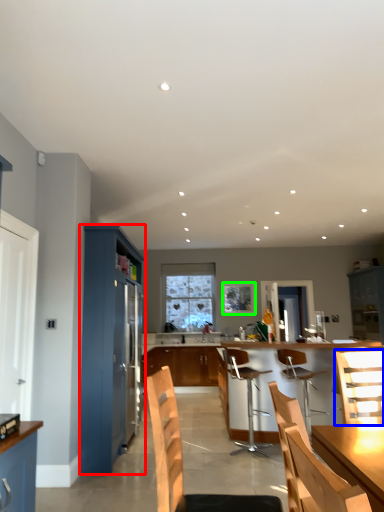
Question: Based on their relative distances, which object is farther from cabinetry (highlighted by a red box)? Choose from chair (highlighted by a blue box) and window screen (highlighted by a green box).

Choices:
 (A) chair
 (B) window screen

Answer: (B)